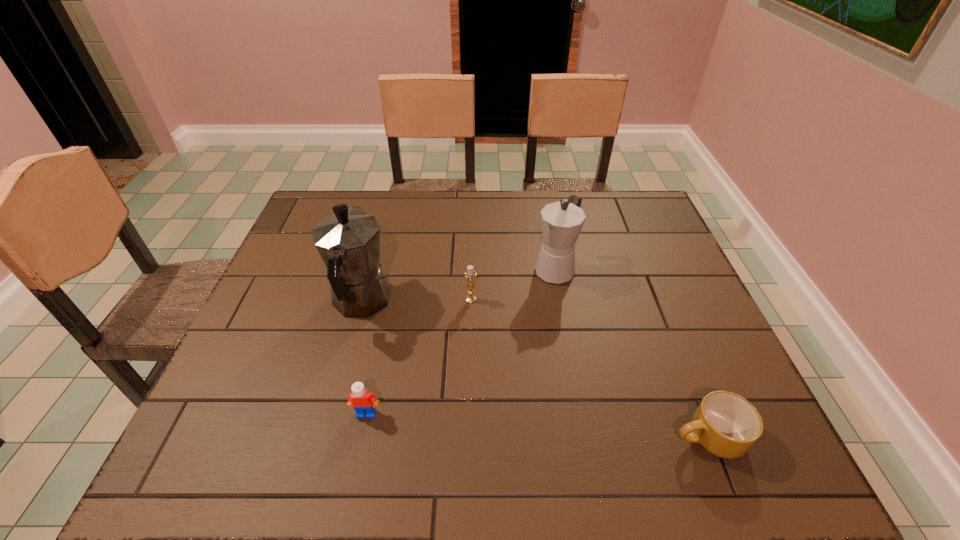
The width and height of the screenshot is (960, 540). I want to click on vacant point at the near edge, so click(341, 469).

I want to click on vacant position at the left edge of the desktop, so click(x=318, y=310).

You are a GUI agent. You are given a task and a screenshot of the screen. Output one action in this format:
    pyautogui.click(x=<x>, y=<y>)
    Task: Click on the vacant space at the right edge
    The width and height of the screenshot is (960, 540).
    Given the screenshot: What is the action you would take?
    pyautogui.click(x=682, y=309)

Find the location of a particular element. vacant region at the near left corner of the desktop is located at coordinates (210, 454).

Find the location of a particular element. The width and height of the screenshot is (960, 540). vacant space at the far right corner of the desktop is located at coordinates (615, 214).

The width and height of the screenshot is (960, 540). I want to click on vacant region between the second tallest object and the candle holder, so click(513, 284).

At what (x,y) coordinates should I click in order to perform the action: click on empty space that is in between the rightmost object and the Lego. Please return your answer as a coordinate pair (x, y). The width and height of the screenshot is (960, 540). Looking at the image, I should click on [x=537, y=426].

This screenshot has width=960, height=540. I want to click on free space between the left coffeepot and the candle holder, so click(416, 301).

Where is `vacant area between the tallest object and the shortest object`? vacant area between the tallest object and the shortest object is located at coordinates (534, 370).

Find the location of a particular element. vacant space in between the Lego and the second tallest object is located at coordinates (461, 341).